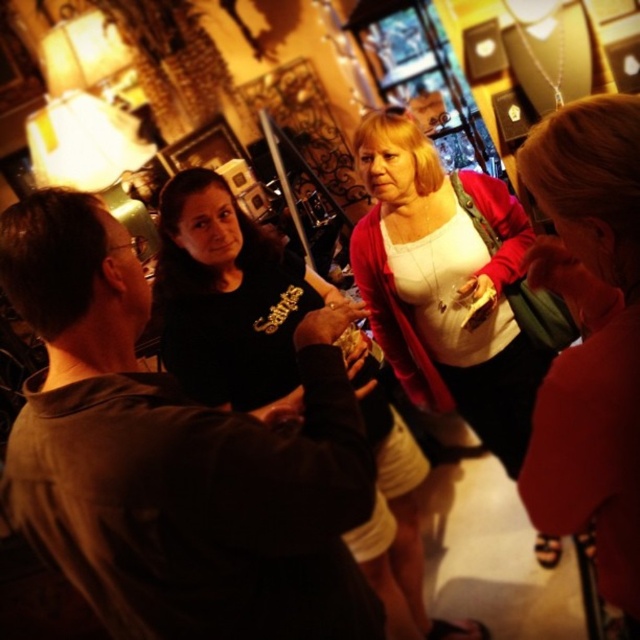
You are at a party and want to get a drink from the bar. You see the dark brown leather jacket at center and the matte red shirt at center. Which one is closer to you?

The dark brown leather jacket at center is closer to you because the matte red shirt at center is behind it.